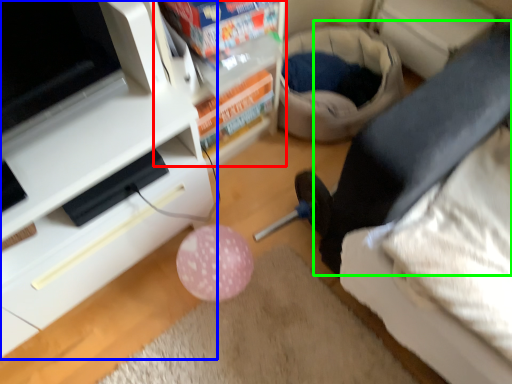
Question: Which object is positioned closest to shelf (highlighted by a red box)? Select from furniture (highlighted by a blue box) and leg (highlighted by a green box).

Choices:
 (A) furniture
 (B) leg

Answer: (A)